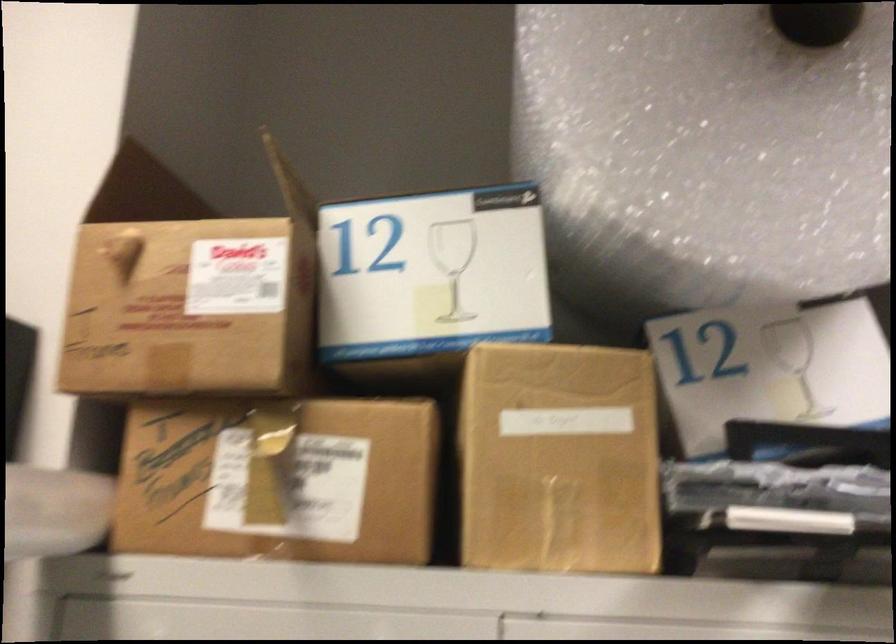
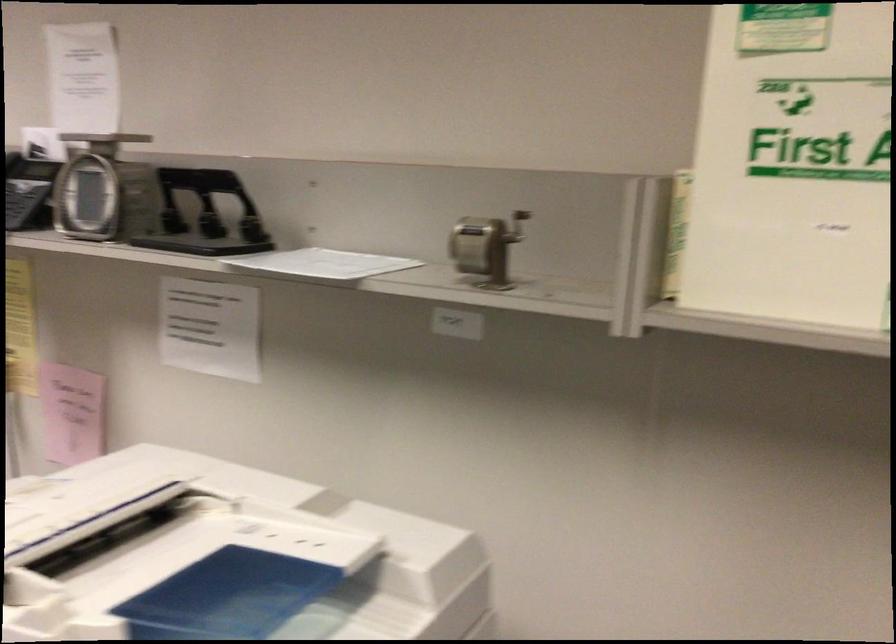
First-person continuous shooting, in which direction is the camera rotating?

The camera rotated toward right-down.